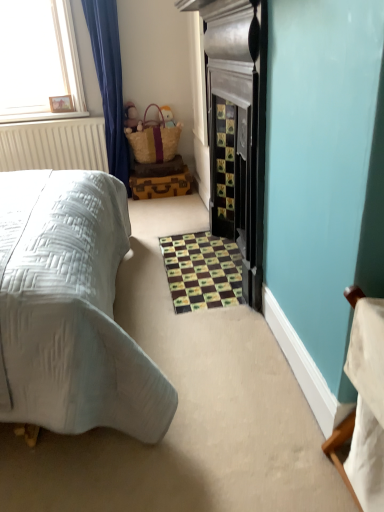
Question: From the image's perspective, does matte brown wicker basket at upper center, arranged as the 2th toy when viewed from the left, appear higher than woven straw basket at upper center?

Choices:
 (A) yes
 (B) no

Answer: (A)

Question: Considering the relative positions of matte brown wicker basket at upper center, acting as the first toy starting from the right, and woven straw basket at upper center in the image provided, is matte brown wicker basket at upper center, acting as the first toy starting from the right, to the left of woven straw basket at upper center from the viewer's perspective?

Choices:
 (A) yes
 (B) no

Answer: (B)

Question: Is matte brown wicker basket at upper center, arranged as the 2th toy when viewed from the left, turned away from woven straw basket at upper center?

Choices:
 (A) yes
 (B) no

Answer: (A)

Question: Is matte brown wicker basket at upper center, acting as the first toy starting from the right, shorter than woven straw basket at upper center?

Choices:
 (A) yes
 (B) no

Answer: (A)

Question: Is woven straw basket at upper center surrounded by matte brown wicker basket at upper center, acting as the first toy starting from the right?

Choices:
 (A) yes
 (B) no

Answer: (B)

Question: Are matte brown wicker basket at upper center, arranged as the 2th toy when viewed from the left, and woven straw basket at upper center far apart?

Choices:
 (A) no
 (B) yes

Answer: (A)

Question: Could matte brown plush toy at upper left, the second toy positioned from the right, be considered to be inside woven straw basket at upper center?

Choices:
 (A) no
 (B) yes

Answer: (B)

Question: From the image's perspective, is woven straw basket at upper center on top of matte brown plush toy at upper left, which is counted as the 1th toy, starting from the left?

Choices:
 (A) yes
 (B) no

Answer: (B)

Question: From the image's perspective, does woven straw basket at upper center appear lower than matte brown plush toy at upper left, the second toy positioned from the right?

Choices:
 (A) yes
 (B) no

Answer: (A)

Question: Does woven straw basket at upper center have a greater width compared to matte brown plush toy at upper left, which is counted as the 1th toy, starting from the left?

Choices:
 (A) no
 (B) yes

Answer: (B)

Question: Is woven straw basket at upper center positioned in front of matte brown plush toy at upper left, which is counted as the 1th toy, starting from the left?

Choices:
 (A) yes
 (B) no

Answer: (A)

Question: Is woven straw basket at upper center behind matte brown plush toy at upper left, which is counted as the 1th toy, starting from the left?

Choices:
 (A) no
 (B) yes

Answer: (A)

Question: Is woven straw basket at upper center closer to the viewer compared to matte brown wicker basket at upper center, arranged as the 2th toy when viewed from the left?

Choices:
 (A) no
 (B) yes

Answer: (B)